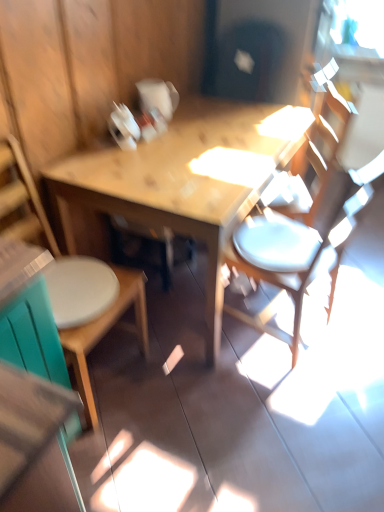
At what (x,y) coordinates should I click in order to perform the action: click on free space in front of white matte chair at right, placed as the 1th chair when sorted from right to left. Please return your answer as a coordinate pair (x, y). The width and height of the screenshot is (384, 512). Looking at the image, I should click on (285, 399).